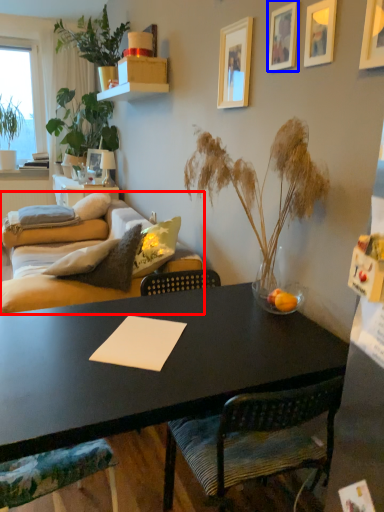
Question: Which point is closer to the camera, studio couch (highlighted by a red box) or picture frame (highlighted by a blue box)?

Choices:
 (A) studio couch
 (B) picture frame

Answer: (B)